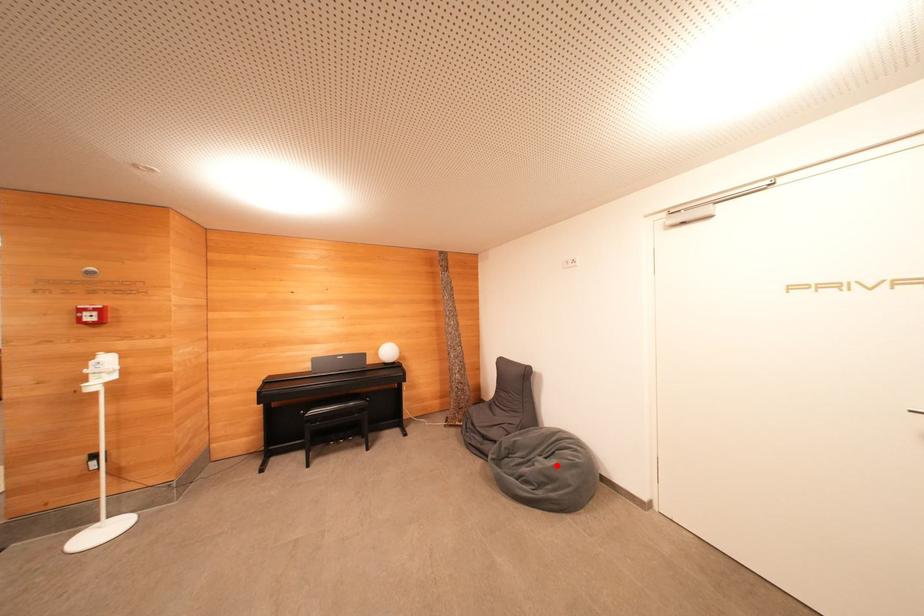
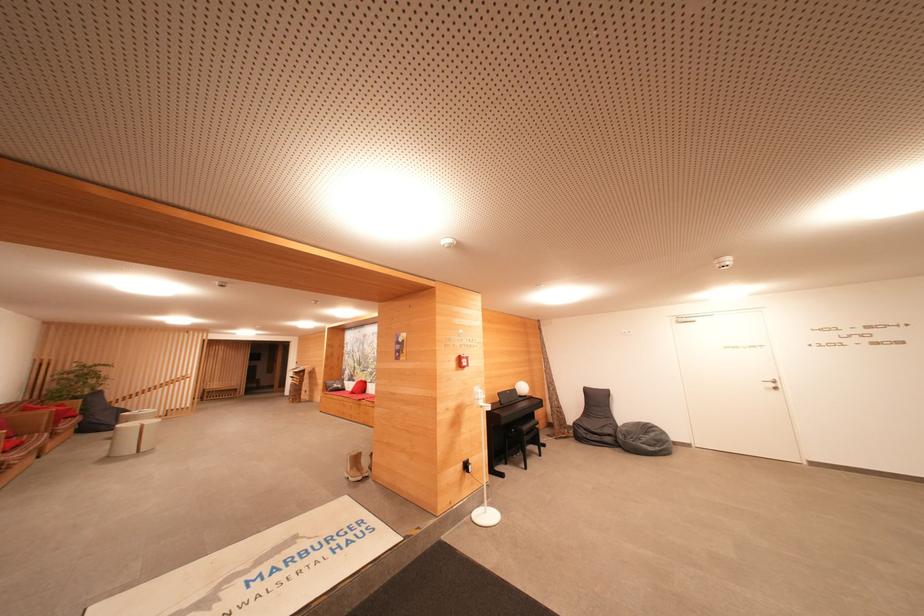
Where in the second image is the point corresponding to the highlighted location from the first image?

(655, 438)